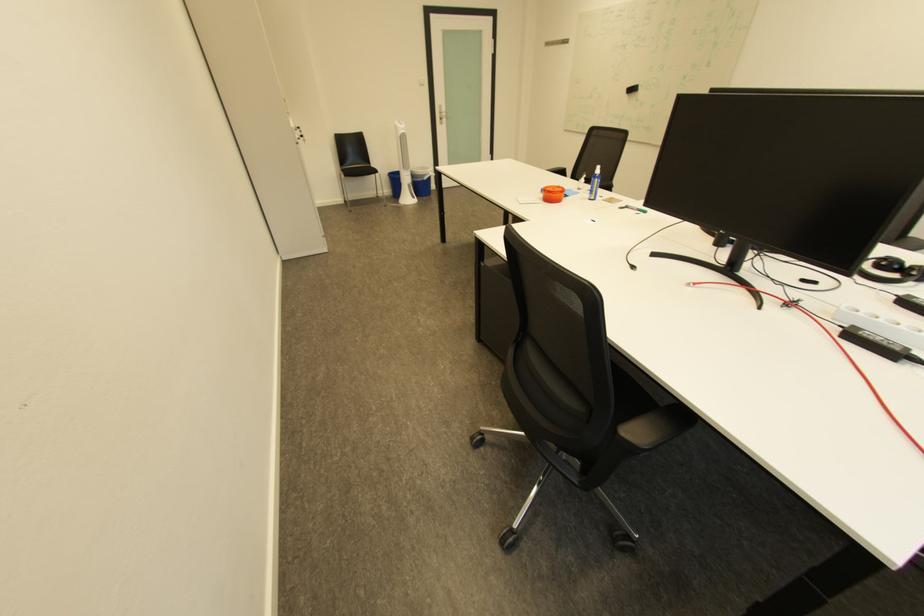
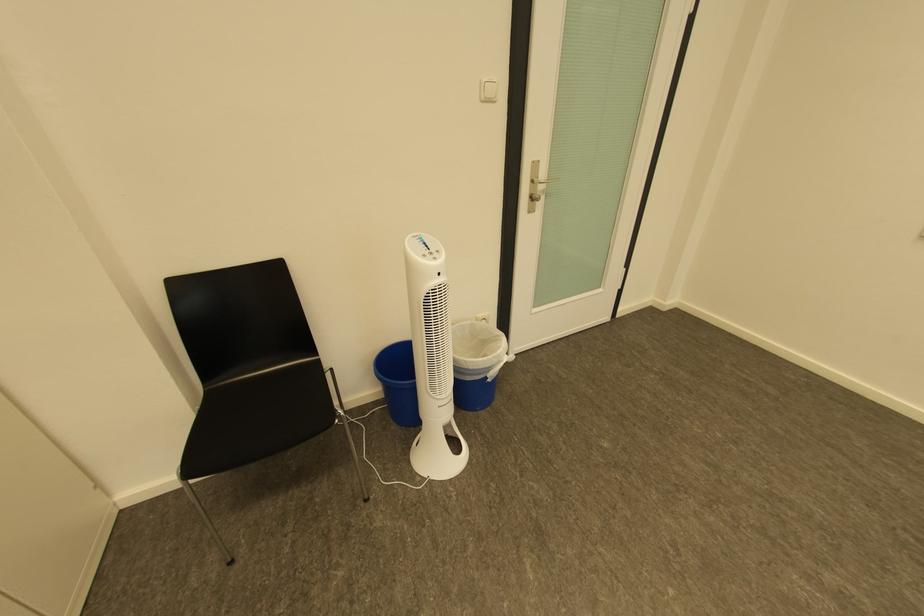
Question: Which direction would the cameraman need to move to produce the second image? Reply with the corresponding letter.

Choices:
 (A) Left
 (B) Right
 (C) Forward
 (D) Backward

Answer: (C)